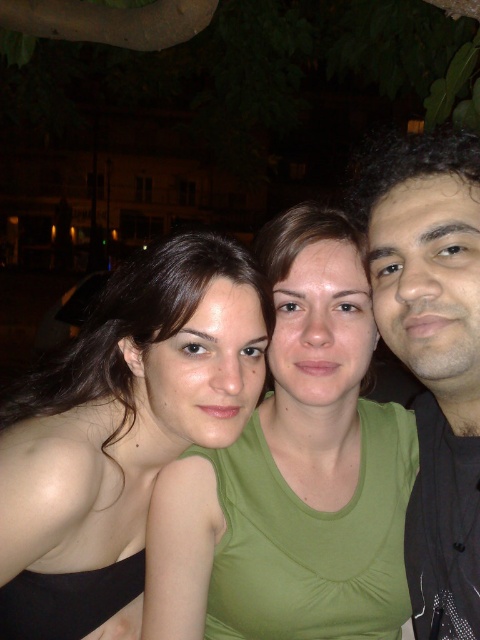
You are a photographer trying to adjust the lighting for a night portrait. You notice the green matte tank top at center and the black matte shirt at right. Which of these two items is positioned lower in the image?

The green matte tank top at center is positioned lower than the black matte shirt at right in the image.

You are a photographer trying to decide which of the two black tops to focus on in the image. The matte black tank top at center and the black matte shirt at right are both in the frame. Based on their lengths, which one is more likely to show more of the person wearing it?

The matte black tank top at center is shorter than the black matte shirt at right, so it will show more of the person wearing it.

You are a photographer adjusting the camera focus. The scene has two central tank tops, a green matte tank top at center and a matte black tank top at center. Which tank top should you focus on if you want to ensure the taller one is sharp?

The green matte tank top at center has a greater height compared to the matte black tank top at center, so you should focus on the green matte tank top at center to ensure the taller one is sharp.